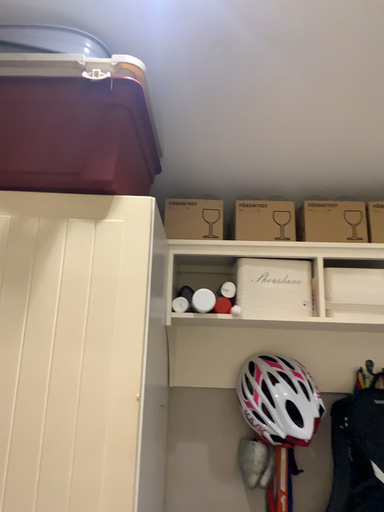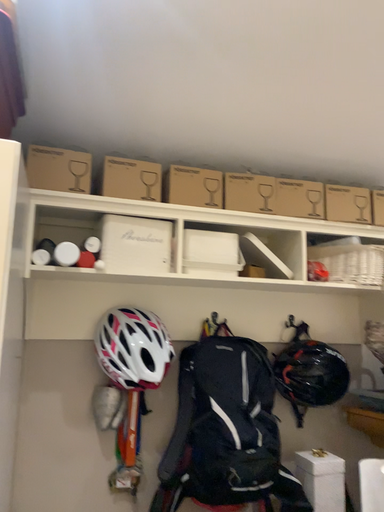
Question: Which way did the camera rotate in the video?

Choices:
 (A) rotated left
 (B) rotated right

Answer: (B)